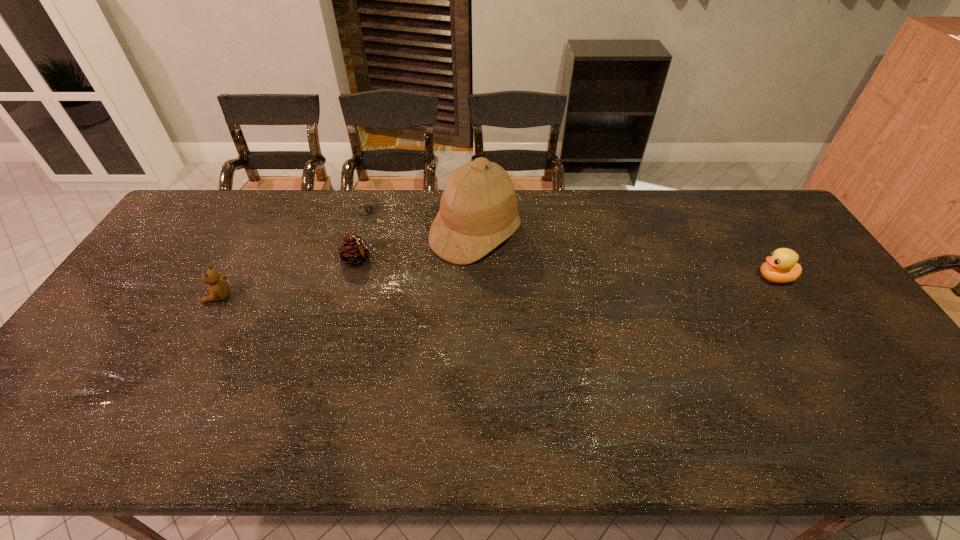
Image resolution: width=960 pixels, height=540 pixels. I want to click on free space between the pinecone and the tallest object, so click(x=417, y=247).

The height and width of the screenshot is (540, 960). In order to click on free spot between the tallest object and the shortest object in this screenshot , I will do `click(421, 221)`.

Find the location of a particular element. This screenshot has height=540, width=960. free space between the pinecone and the watch is located at coordinates (364, 234).

You are a GUI agent. You are given a task and a screenshot of the screen. Output one action in this format:
    pyautogui.click(x=<x>, y=<y>)
    Task: Click on the free space that is in between the second object from right to left and the watch
    
    Given the screenshot: What is the action you would take?
    pyautogui.click(x=421, y=221)

Locate an element on the screen. The image size is (960, 540). empty space between the tallest object and the pinecone is located at coordinates (417, 247).

Where is `free area in between the rightmost object and the watch`? free area in between the rightmost object and the watch is located at coordinates (571, 244).

Where is `vacant space that is in between the watch and the teddy bear`? vacant space that is in between the watch and the teddy bear is located at coordinates (293, 253).

You are a GUI agent. You are given a task and a screenshot of the screen. Output one action in this format:
    pyautogui.click(x=<x>, y=<y>)
    Task: Click on the second closest object to the pinecone
    
    Given the screenshot: What is the action you would take?
    pyautogui.click(x=370, y=208)

Select which object is the third closest to the rightmost object. Please provide its 2D coordinates. Your answer should be formatted as a tuple, i.e. [(x, y)], where the tuple contains the x and y coordinates of a point satisfying the conditions above.

[(370, 208)]

At what (x,y) coordinates should I click in order to perform the action: click on free point that satisfies the following two spatial constraints: 1. on the front side of the shortest object; 2. on the right side of the hat. Please return your answer as a coordinate pair (x, y). Looking at the image, I should click on (361, 234).